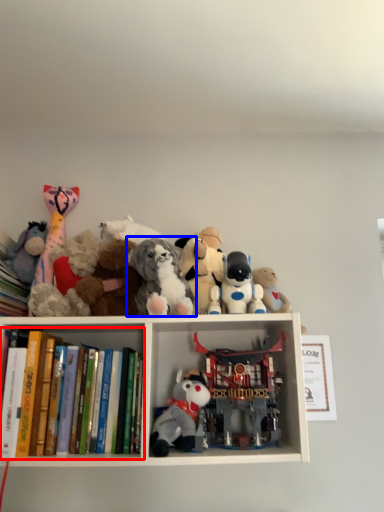
Question: Among these objects, which one is farthest to the camera, book (highlighted by a red box) or toy (highlighted by a blue box)?

Choices:
 (A) book
 (B) toy

Answer: (B)